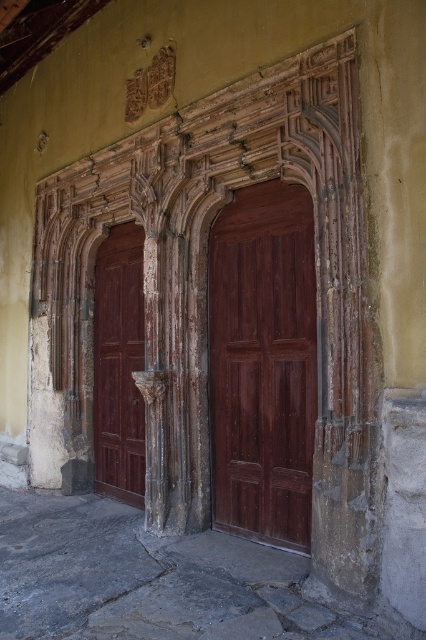
Between wooden carved archway at center and matte wood door at center, which one is positioned lower?

wooden carved archway at center is lower down.

Looking at this image, measure the distance between point (181, 182) and camera.

Point (181, 182) is 6.16 meters away from camera.

Locate an element on the screen. The image size is (426, 640). wooden carved archway at center is located at coordinates (207, 289).

Is point (308, 262) less distant than point (126, 396)?

Yes, point (308, 262) is closer to viewer.

Between point (247, 364) and point (118, 481), which one is positioned in front?

Point (247, 364) is more forward.

Where is `matte wood door at center`? The width and height of the screenshot is (426, 640). matte wood door at center is located at coordinates (262, 364).

Does wooden carved archway at center have a greater height compared to matte wood door at left?

No, wooden carved archway at center is not taller than matte wood door at left.

Who is positioned more to the left, wooden carved archway at center or matte wood door at left?

From the viewer's perspective, matte wood door at left appears more on the left side.

What do you see at coordinates (207, 289) in the screenshot? This screenshot has height=640, width=426. I see `wooden carved archway at center` at bounding box center [207, 289].

This screenshot has height=640, width=426. I want to click on wooden carved archway at center, so click(207, 289).